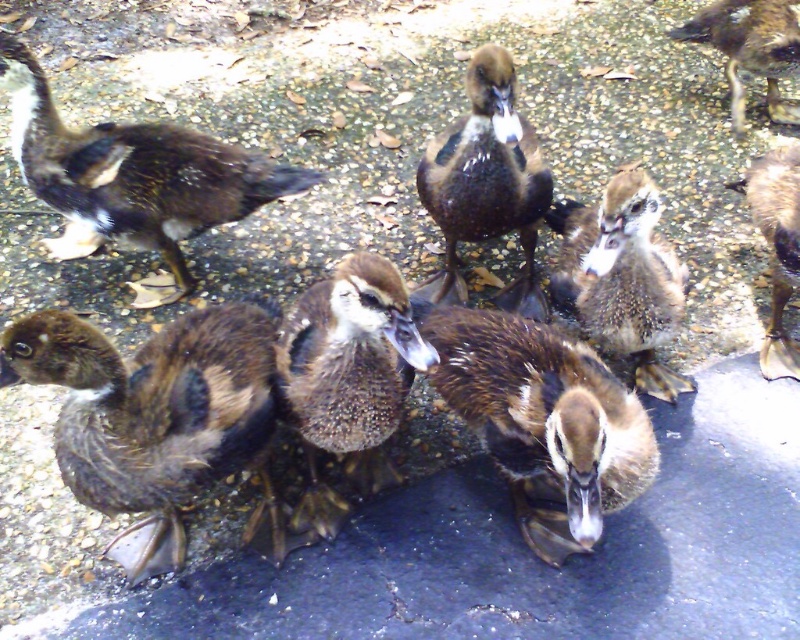
In the scene shown: Does brown fuzzy duckling at center appear under speckled brown duckling at upper center?

Correct, brown fuzzy duckling at center is located below speckled brown duckling at upper center.

Who is more distant from viewer, [544,483] or [696,19]?

Point [696,19]

Locate an element on the screen. Image resolution: width=800 pixels, height=640 pixels. brown fuzzy duckling at center is located at coordinates (542, 420).

Can you confirm if speckled feather duckling at center is taller than speckled brown duckling at upper center?

Yes, speckled feather duckling at center is taller than speckled brown duckling at upper center.

Between point (652, 252) and point (744, 24), which one is positioned behind?

Point (744, 24)

Who is more distant from viewer, (574, 234) or (678, 38)?

Point (678, 38)

Where is `speckled feather duckling at center`? speckled feather duckling at center is located at coordinates (622, 276).

Who is more distant from viewer, (86,342) or (524,404)?

The point (524,404) is more distant.

Can you confirm if brown fuzzy duckling at lower left is positioned to the right of brown fuzzy duckling at center?

Incorrect, brown fuzzy duckling at lower left is not on the right side of brown fuzzy duckling at center.

The height and width of the screenshot is (640, 800). In order to click on brown fuzzy duckling at lower left in this screenshot , I will do `click(156, 419)`.